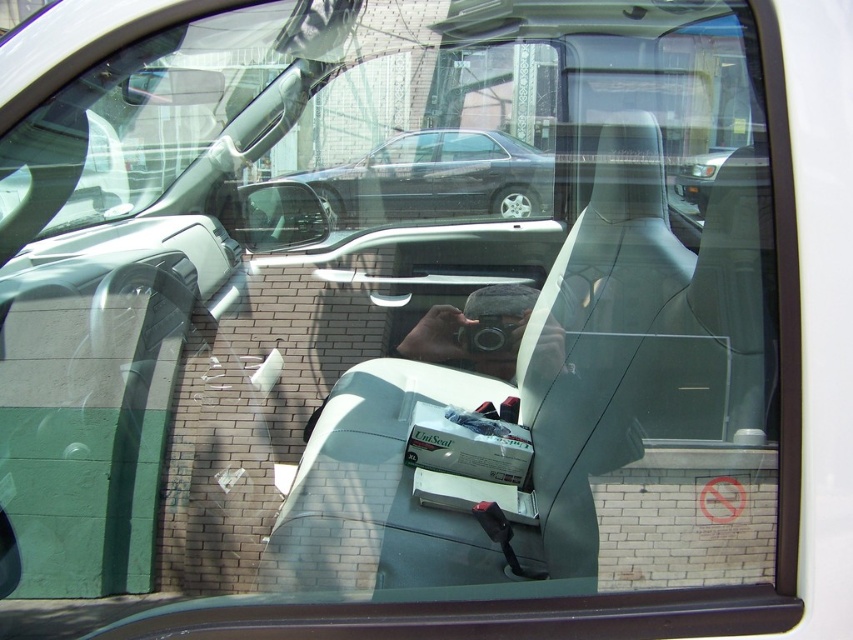
You are a passenger in a car and want to take a photo of the shiny black sedan at center and the matte plastic side mirror at upper left through the window. Which object will appear taller in your photo?

The shiny black sedan at center will appear taller in the photo because it has a greater height compared to the matte plastic side mirror at upper left.

You are a passenger in the car and want to describe the vehicle outside the window using coordinates. What does the point at coordinates point [436,179] represent?

The point at coordinates point [436,179] represents a shiny black sedan at center.